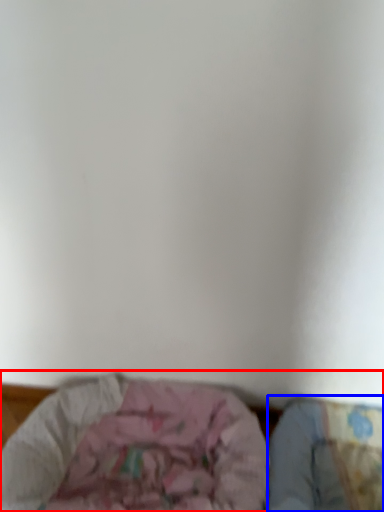
Question: Which of the following is the closest to the observer, furniture (highlighted by a red box) or sheet (highlighted by a blue box)?

Choices:
 (A) furniture
 (B) sheet

Answer: (A)